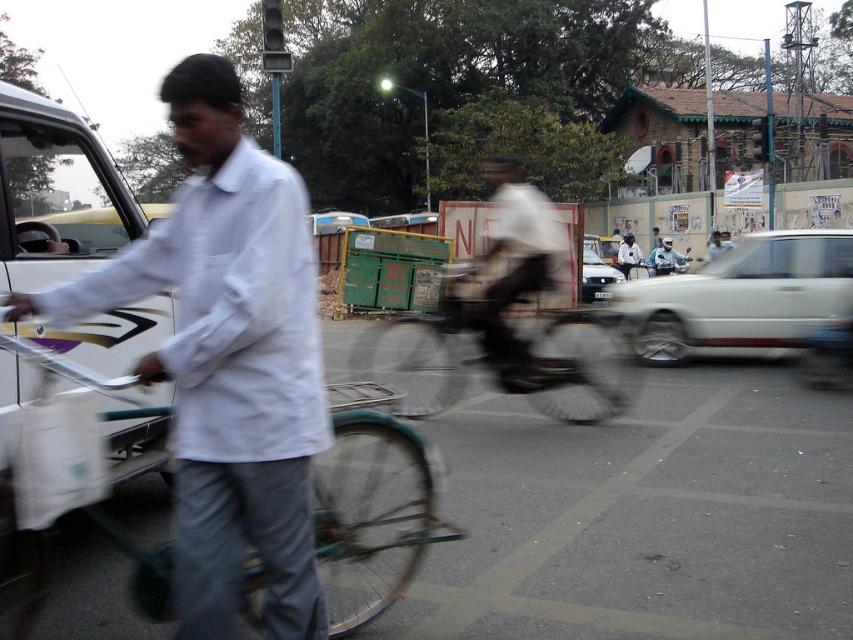
You are a delivery person needing to cross the street safely. You see a white glossy car at right and a blue fabric shirt at center. Which object is closer to you as you stand at the curb?

The blue fabric shirt at center is closer to you than the white glossy car at right because the distance between them is 47.02 feet, meaning the shirt is nearer.

You are standing at the point with coordinates point (751,275) and want to walk to the point with coordinates point (408,412). Which direction should you move relative to the scene?

You should move forward because point (408,412) is in front of point (751,275) according to the scene description.